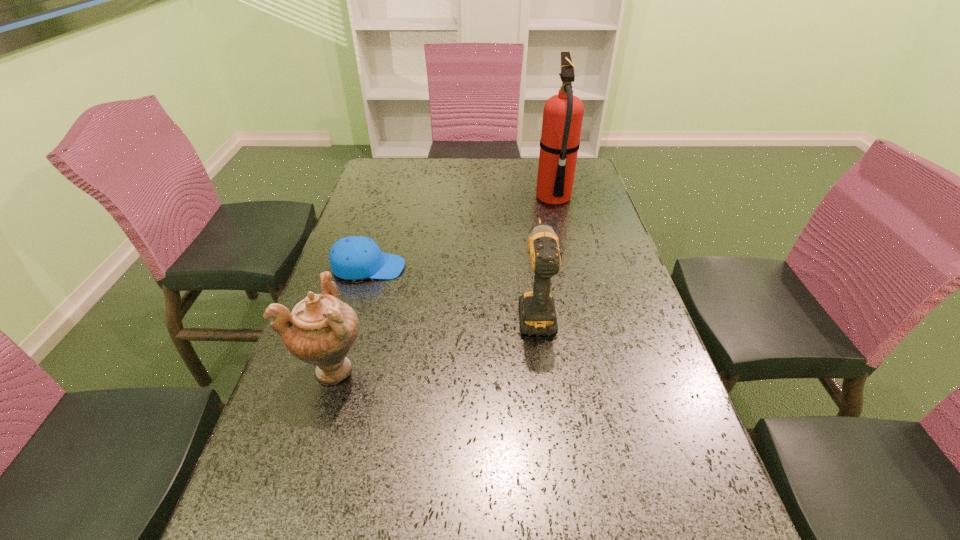
Find the location of `free space that satisfies the following two spatial constraints: 1. at the nozzle of the fire extinguisher; 2. on the front side of the urn`. free space that satisfies the following two spatial constraints: 1. at the nozzle of the fire extinguisher; 2. on the front side of the urn is located at coordinates (594, 367).